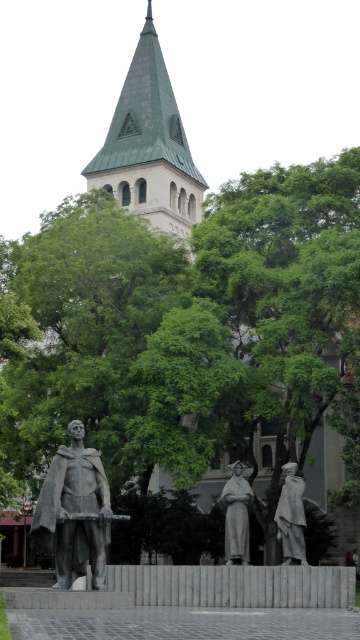
Question: Among these objects, which one is nearest to the camera?

Choices:
 (A) polished bronze statue at center
 (B) green metal tower at upper center
 (C) bronze statue at right
 (D) bronze statue at center

Answer: (D)

Question: Is green leafy tree at center positioned in front of bronze statue at right?

Choices:
 (A) no
 (B) yes

Answer: (A)

Question: Among these points, which one is nearest to the camera?

Choices:
 (A) (240, 554)
 (B) (281, 492)
 (C) (101, 474)

Answer: (C)

Question: Which object is closer to the camera taking this photo?

Choices:
 (A) green metal tower at upper center
 (B) polished bronze statue at center

Answer: (B)

Question: Is green metal tower at upper center to the left of bronze statue at right from the viewer's perspective?

Choices:
 (A) yes
 (B) no

Answer: (A)

Question: Considering the relative positions of green metal tower at upper center and bronze statue at center in the image provided, where is green metal tower at upper center located with respect to bronze statue at center?

Choices:
 (A) right
 (B) left

Answer: (A)